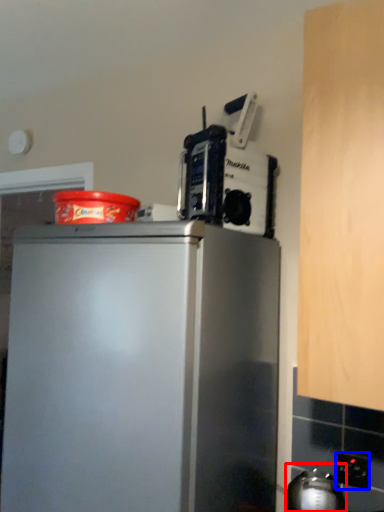
Question: Which object appears farthest to the camera in this image, appliance (highlighted by a red box) or electric outlet (highlighted by a blue box)?

Choices:
 (A) appliance
 (B) electric outlet

Answer: (B)